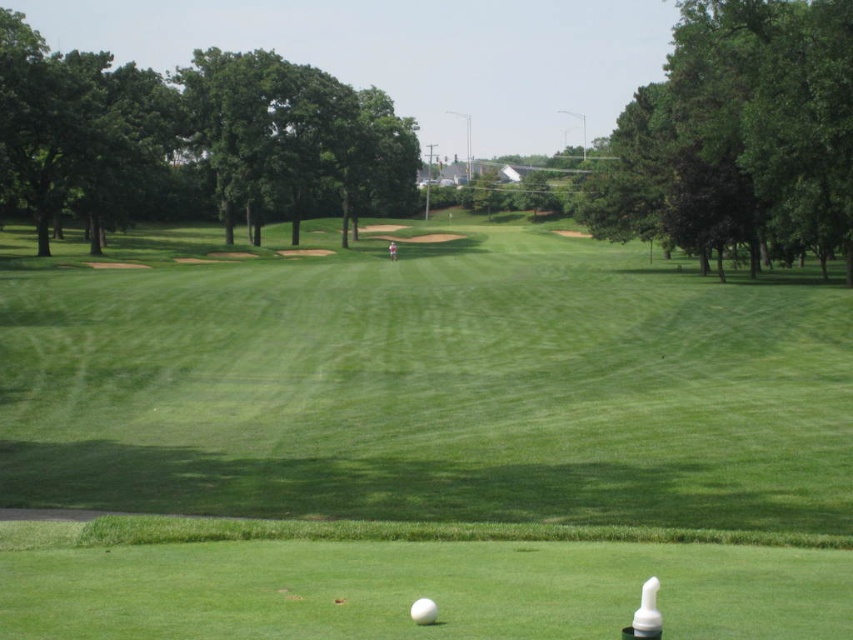
Question: Is green grassy field at center to the left of white matte golf ball at center from the viewer's perspective?

Choices:
 (A) no
 (B) yes

Answer: (B)

Question: Which point is farther to the camera?

Choices:
 (A) (535, 545)
 (B) (428, 618)

Answer: (A)

Question: Is green grassy field at center positioned before white matte golf ball at center?

Choices:
 (A) yes
 (B) no

Answer: (B)

Question: Which point appears farthest from the camera in this image?

Choices:
 (A) (416, 618)
 (B) (764, 566)

Answer: (B)

Question: Does green grassy field at center lie in front of white matte golf ball at center?

Choices:
 (A) yes
 (B) no

Answer: (B)

Question: Among these objects, which one is farthest from the camera?

Choices:
 (A) white matte golf ball at center
 (B) green grassy field at center

Answer: (B)